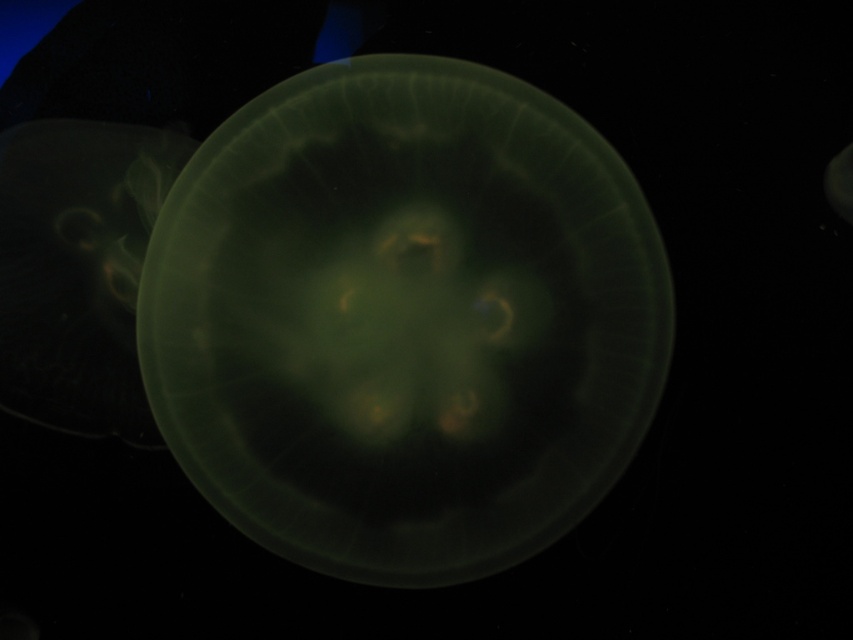
Question: Which point appears closest to the camera in this image?

Choices:
 (A) (19, 275)
 (B) (445, 298)

Answer: (A)

Question: Can you confirm if translucent green jellyfish at center is smaller than translucent green jellyfish at left?

Choices:
 (A) no
 (B) yes

Answer: (A)

Question: Can you confirm if translucent green jellyfish at center is thinner than translucent green jellyfish at left?

Choices:
 (A) yes
 (B) no

Answer: (B)

Question: Does translucent green jellyfish at center have a greater width compared to translucent green jellyfish at left?

Choices:
 (A) no
 (B) yes

Answer: (B)